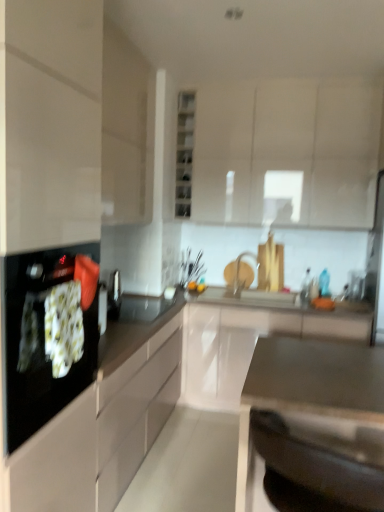
Question: Which direction should I rotate to look at black glossy countertop at center, placed as the second countertop when sorted from front to back?

Choices:
 (A) left
 (B) right

Answer: (B)

Question: Is black glass cooktop at left outside matte white cabinet at upper left, which is the 2th cabinetry in top-to-bottom order?

Choices:
 (A) no
 (B) yes

Answer: (B)

Question: Is black glass cooktop at left far away from matte white cabinet at upper left, the second cabinetry in the bottom-to-top sequence?

Choices:
 (A) yes
 (B) no

Answer: (A)

Question: Does black glass cooktop at left have a lesser height compared to matte white cabinet at upper left, the second cabinetry in the bottom-to-top sequence?

Choices:
 (A) yes
 (B) no

Answer: (A)

Question: Is black glass cooktop at left next to matte white cabinet at upper left, the second cabinetry in the bottom-to-top sequence?

Choices:
 (A) yes
 (B) no

Answer: (B)

Question: From a real-world perspective, is black glass cooktop at left beneath matte white cabinet at upper left, the second cabinetry in the bottom-to-top sequence?

Choices:
 (A) no
 (B) yes

Answer: (B)

Question: From a real-world perspective, is black glass cooktop at left located higher than matte white cabinet at upper left, the second cabinetry in the bottom-to-top sequence?

Choices:
 (A) yes
 (B) no

Answer: (B)

Question: From a real-world perspective, is black glossy countertop at center, positioned as the first countertop in back-to-front order, under satin metallic sink at lower center, which is the second countertop from back to front?

Choices:
 (A) no
 (B) yes

Answer: (A)

Question: Considering the relative sizes of black glossy countertop at center, placed as the second countertop when sorted from front to back, and satin metallic sink at lower center, the first countertop in the front-to-back sequence, in the image provided, is black glossy countertop at center, placed as the second countertop when sorted from front to back, taller than satin metallic sink at lower center, the first countertop in the front-to-back sequence,?

Choices:
 (A) no
 (B) yes

Answer: (B)

Question: Is satin metallic sink at lower center, the first countertop in the front-to-back sequence, inside black glossy countertop at center, positioned as the first countertop in back-to-front order?

Choices:
 (A) no
 (B) yes

Answer: (B)

Question: From the image's perspective, does black glossy countertop at center, placed as the second countertop when sorted from front to back, appear lower than satin metallic sink at lower center, which is the second countertop from back to front?

Choices:
 (A) yes
 (B) no

Answer: (B)

Question: Is black glossy countertop at center, positioned as the first countertop in back-to-front order, outside of satin metallic sink at lower center, which is the second countertop from back to front?

Choices:
 (A) no
 (B) yes

Answer: (B)

Question: Considering the relative sizes of black glossy countertop at center, positioned as the first countertop in back-to-front order, and satin metallic sink at lower center, the first countertop in the front-to-back sequence, in the image provided, is black glossy countertop at center, positioned as the first countertop in back-to-front order, thinner than satin metallic sink at lower center, the first countertop in the front-to-back sequence,?

Choices:
 (A) yes
 (B) no

Answer: (B)

Question: Can you confirm if white glossy cabinet at center, the 1th cabinetry positioned from the bottom, is wider than black glass cooktop at left?

Choices:
 (A) yes
 (B) no

Answer: (A)